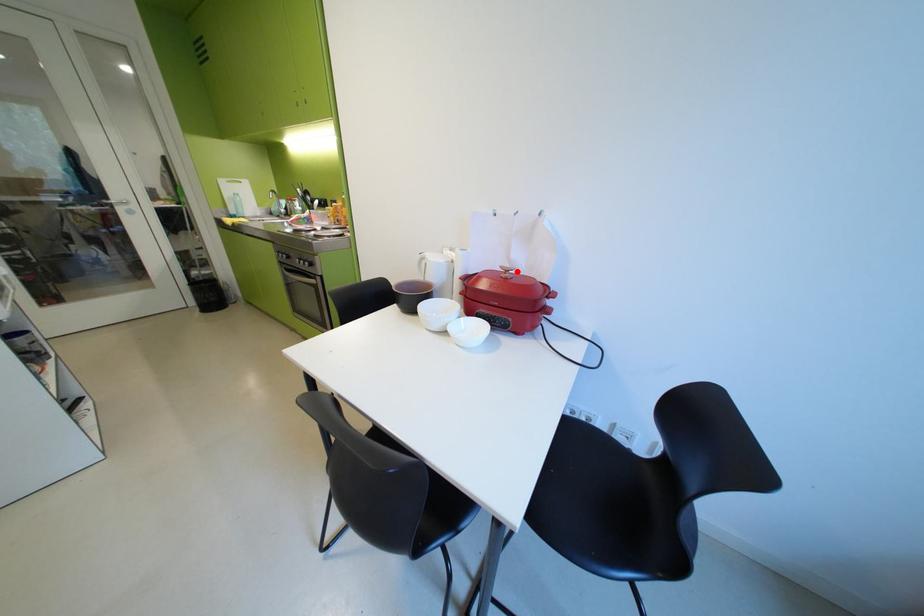
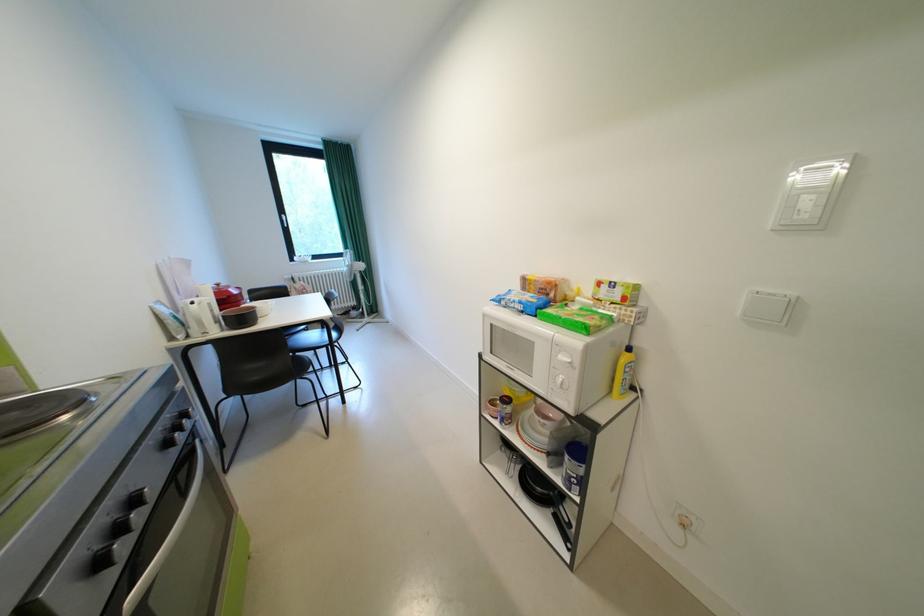
Question: A red point is marked in image1. In image2, is the corresponding 3D point closer to the camera or farther? Reply with the corresponding letter.

Choices:
 (A) The corresponding 3D point is closer.
 (B) The corresponding 3D point is farther.

Answer: (A)